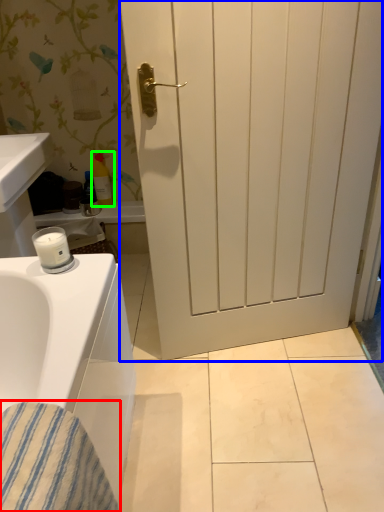
Question: Which object is positioned farthest from material (highlighted by a red box)? Select from door (highlighted by a blue box) and toiletry (highlighted by a green box).

Choices:
 (A) door
 (B) toiletry

Answer: (B)